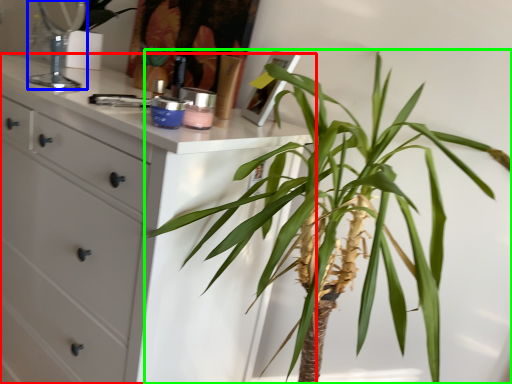
Question: Based on their relative distances, which object is farther from chest of drawers (highlighted by a red box)? Choose from mirror (highlighted by a blue box) and houseplant (highlighted by a green box).

Choices:
 (A) mirror
 (B) houseplant

Answer: (A)